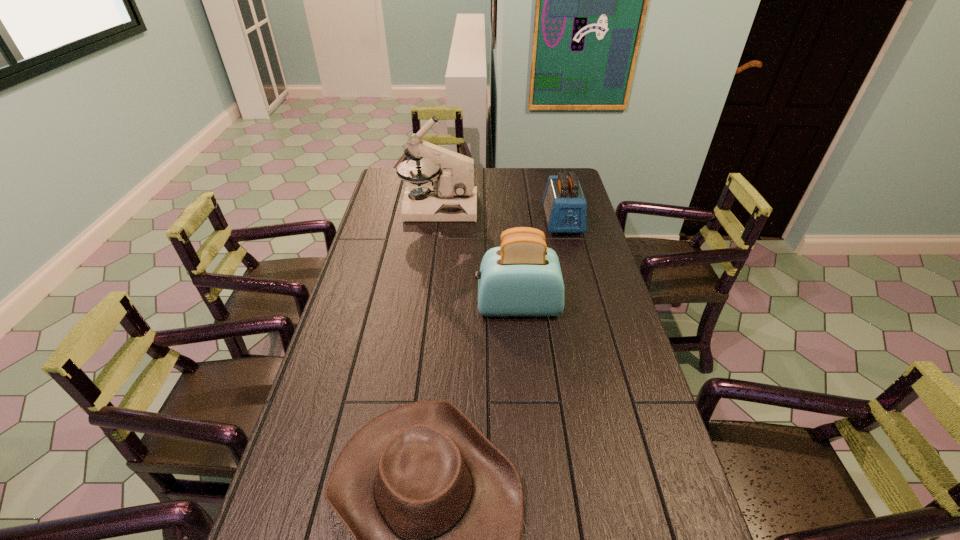
I want to click on the tallest object, so click(452, 197).

Locate an element on the screen. the third shortest object is located at coordinates (522, 277).

Find the location of a particular element. The width and height of the screenshot is (960, 540). the left toaster is located at coordinates (522, 277).

Image resolution: width=960 pixels, height=540 pixels. Find the location of `the farther toaster`. the farther toaster is located at coordinates (565, 206).

The image size is (960, 540). Find the location of `the shorter toaster`. the shorter toaster is located at coordinates (565, 206).

Find the location of a particular element. free location located 0.220m at the eyepiece of the microscope is located at coordinates (528, 208).

Where is `vacant area situated on the side of the second nearest object with the lever`? The image size is (960, 540). vacant area situated on the side of the second nearest object with the lever is located at coordinates (363, 306).

Find the location of a particular element. This screenshot has height=540, width=960. vacant space located 0.080m on the side of the second nearest object with the lever is located at coordinates (451, 306).

Locate an element on the screen. free space located 0.350m on the side of the second nearest object with the lever is located at coordinates (369, 306).

At what (x,y) coordinates should I click in order to perform the action: click on blank space located on the front-facing side of the third tallest object. Please return your answer as a coordinate pair (x, y). Looking at the image, I should click on (570, 252).